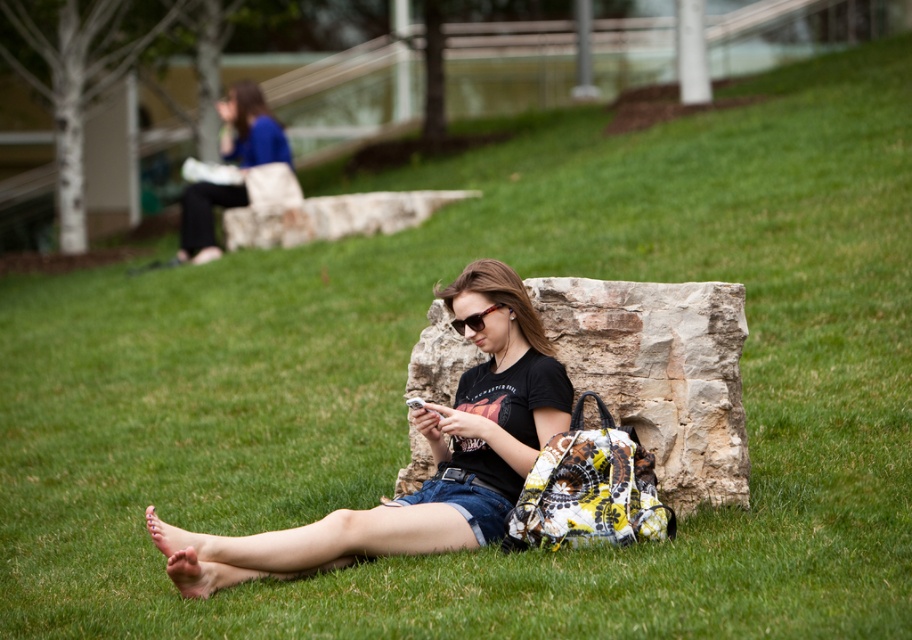
You are a photographer aiming to capture both the blue fabric bag at upper left and the translucent orange sunglasses at center in a single frame. Based on their positions, which object should you adjust your camera angle to focus on first to ensure both are in the shot?

The blue fabric bag at upper left is to the left of the translucent orange sunglasses at center, so you should adjust your camera angle to focus on the translucent orange sunglasses at center first to ensure both are included in the frame.

You are a photographer trying to capture the blue fabric bag at upper left and the translucent orange sunglasses at center in the same frame. Based on their sizes in the image, which object would appear smaller in the photo?

The blue fabric bag at upper left would appear smaller in the photo because it is thinner than the translucent orange sunglasses at center.